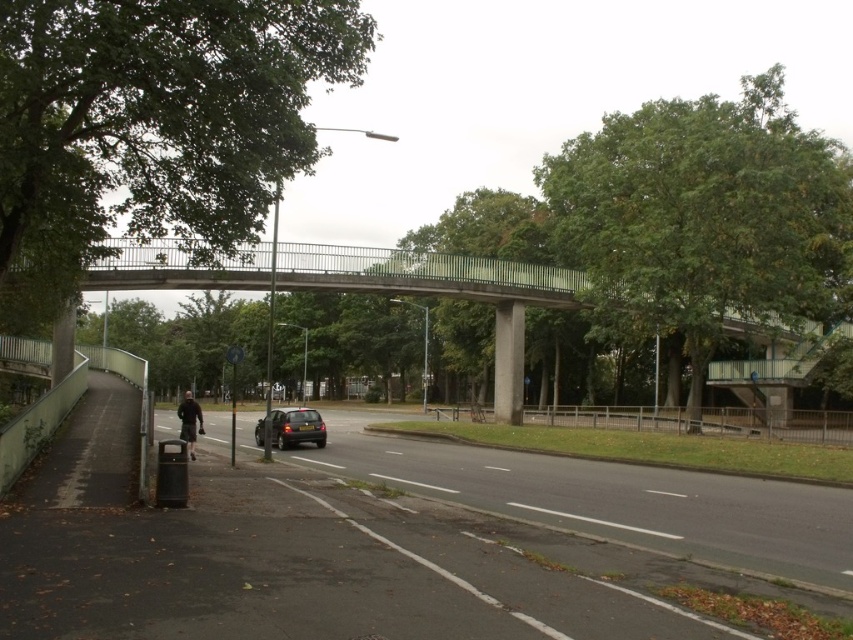
You are a delivery person standing at point (358,285). You need to cross the road to deliver a package to the address on the other side. Is there a safe path to cross using the structures available in the scene?

The point (358,285) is where the green metallic bridge at center is located. Since the bridge spans over the road, you can safely cross using the green metallic bridge at center.